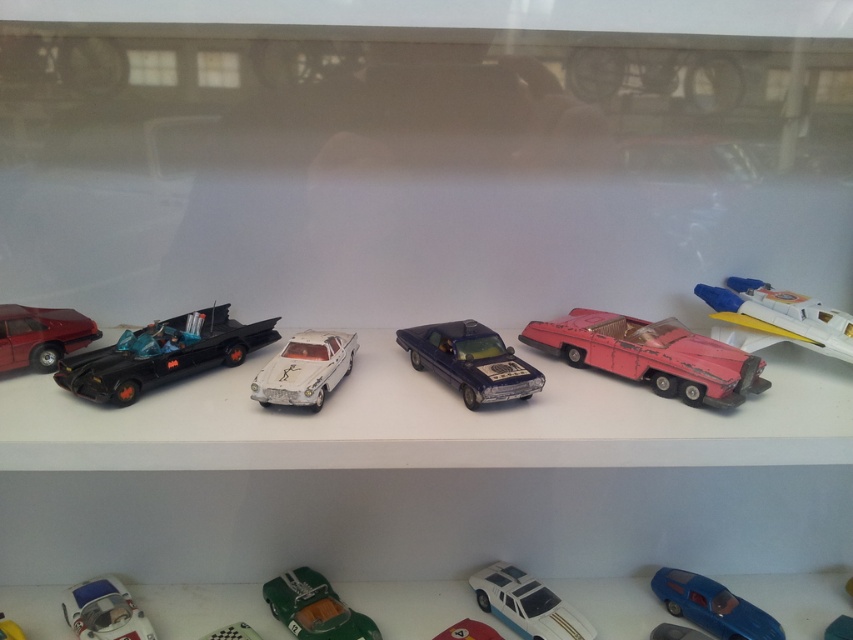
The width and height of the screenshot is (853, 640). I want to click on shiny dark blue car at center, so click(469, 360).

Find the location of a particular element. This screenshot has height=640, width=853. shiny dark blue car at center is located at coordinates (469, 360).

Where is `shiny dark blue car at center`? The height and width of the screenshot is (640, 853). shiny dark blue car at center is located at coordinates (469, 360).

Between white glossy toy car at center and shiny red car at left, which one has less height?

white glossy toy car at center

Who is higher up, white glossy toy car at center or shiny red car at left?

shiny red car at left

Locate an element on the screen. Image resolution: width=853 pixels, height=640 pixels. white glossy toy car at center is located at coordinates (x=526, y=604).

Locate an element on the screen. The width and height of the screenshot is (853, 640). white glossy toy car at center is located at coordinates (526, 604).

Between blue glossy car at lower right and shiny red car at left, which one is positioned higher?

Positioned higher is shiny red car at left.

This screenshot has height=640, width=853. Identify the location of blue glossy car at lower right. pyautogui.click(x=712, y=605).

Find the location of `blue glossy car at lower right`. blue glossy car at lower right is located at coordinates (712, 605).